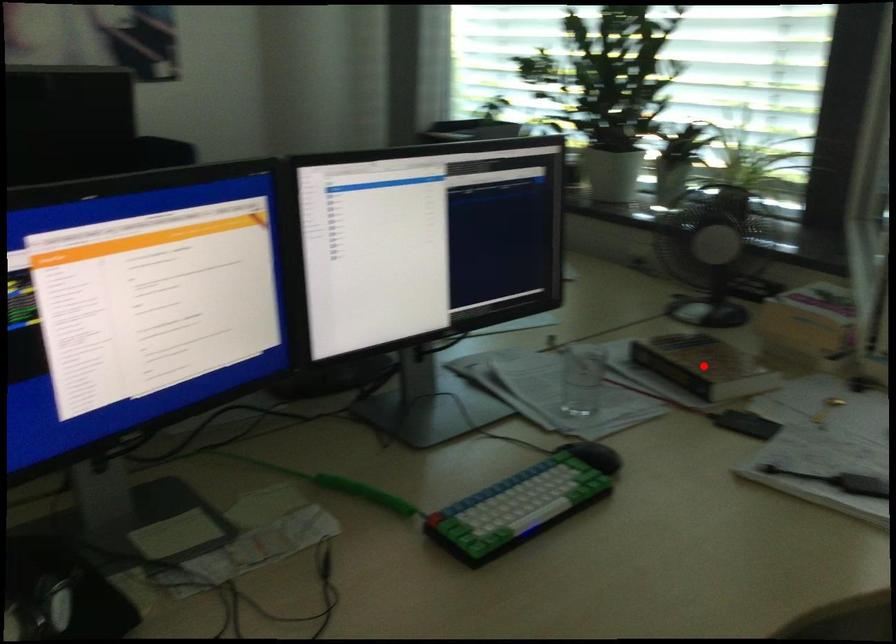
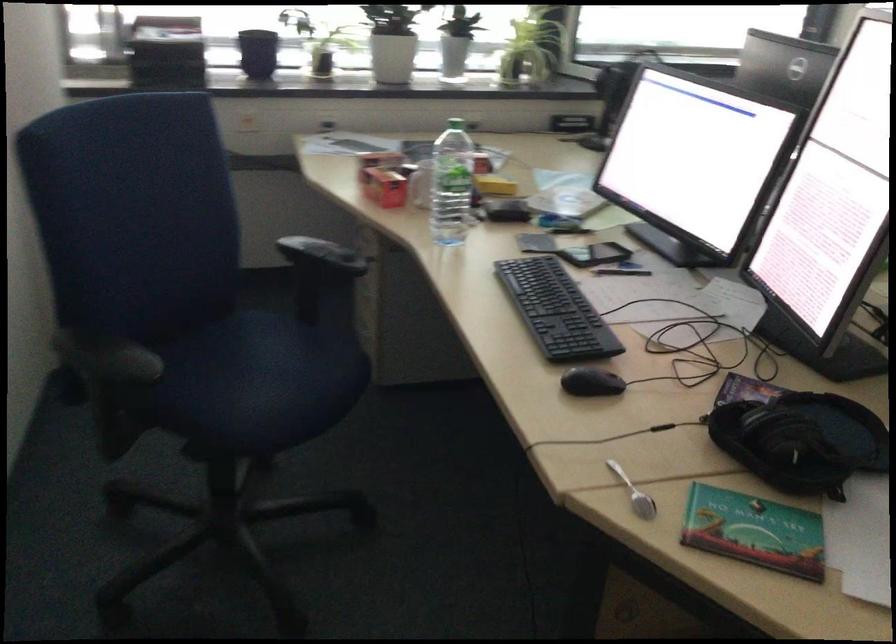
Question: I am providing you with two images of the same scene from different viewpoints. A red point is marked on the first image. Can you still see the location of the red point in image 2?

Choices:
 (A) Yes
 (B) No

Answer: (B)